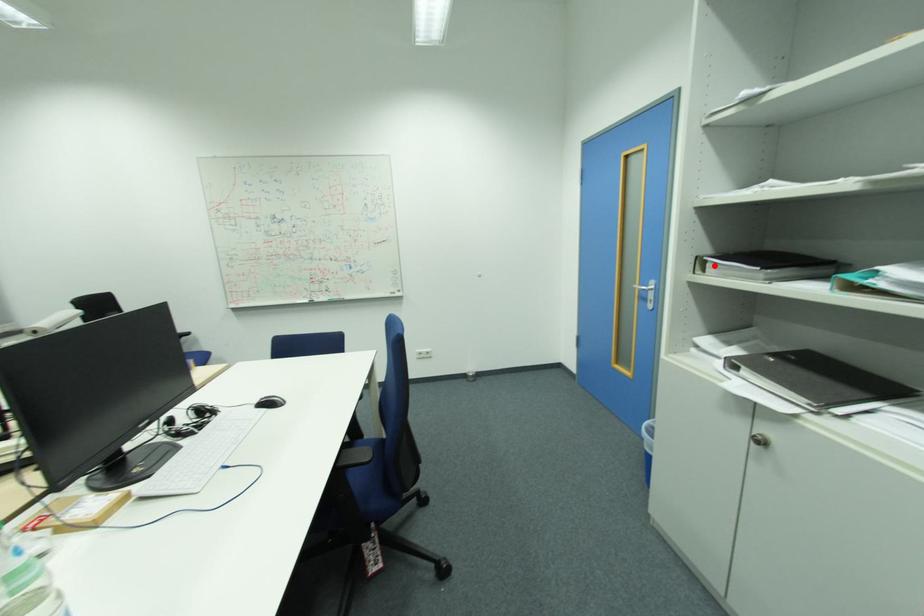
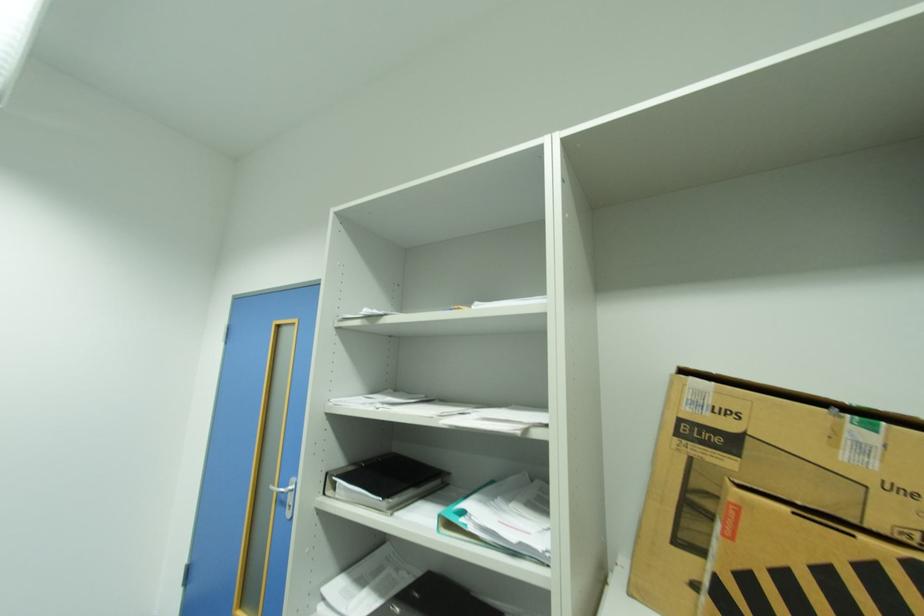
Locate, in the second image, the point that corresponds to the highlighted location in the first image.

(344, 485)